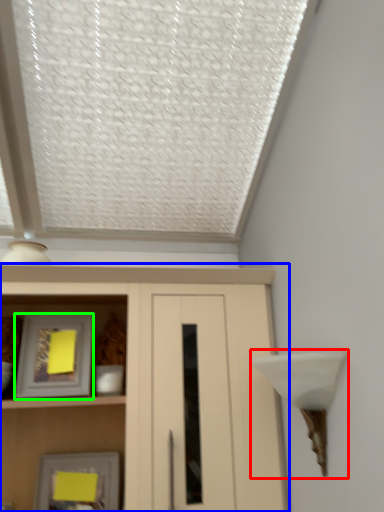
Question: Estimate the real-world distances between objects in this image. Which object is farther from table lamp (highlighted by a red box), cupboard (highlighted by a blue box) or picture frame (highlighted by a green box)?

Choices:
 (A) cupboard
 (B) picture frame

Answer: (B)